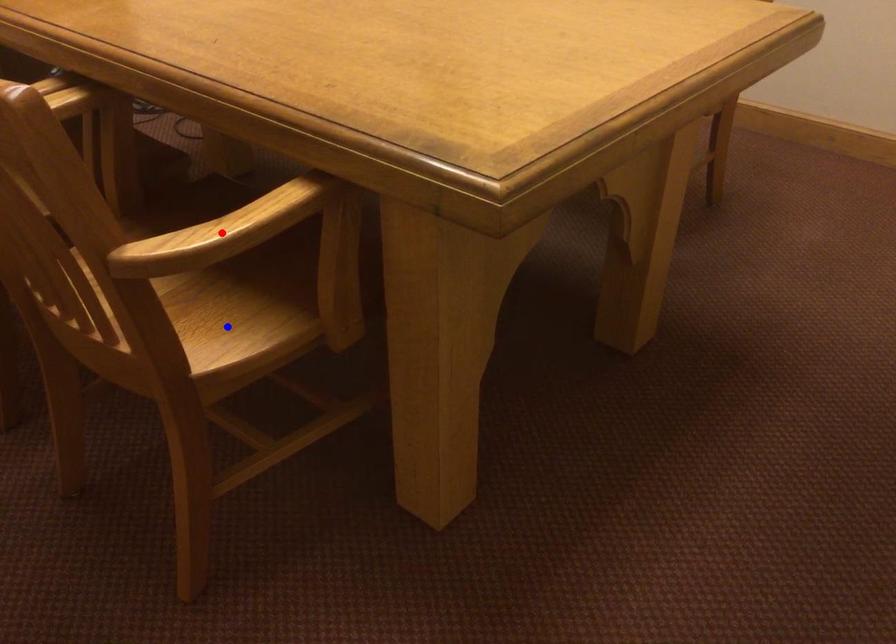
Question: In the image, two points are highlighted. Which point is nearer to the camera? Reply with the corresponding letter.

Choices:
 (A) blue point
 (B) red point

Answer: (B)